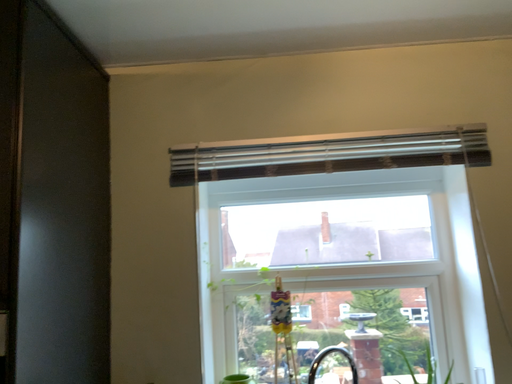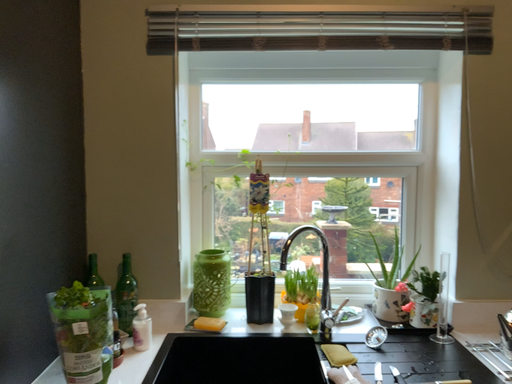
Question: Which way did the camera rotate in the video?

Choices:
 (A) rotated upward
 (B) rotated downward

Answer: (B)